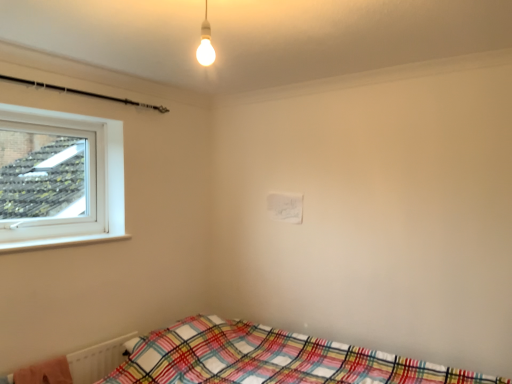
Find the location of a particular element. plaid fabric blanket at lower left is located at coordinates (45, 373).

In the image, there is a plaid fabric bed at lower right. Where is `blanket above it (from the image's perspective)`? Image resolution: width=512 pixels, height=384 pixels. blanket above it (from the image's perspective) is located at coordinates (45, 373).

Is plaid fabric blanket at lower left not within plaid fabric bed at lower right?

Yes.

Which is behind, plaid fabric blanket at lower left or plaid fabric bed at lower right?

plaid fabric blanket at lower left is behind.

Which point is more distant from viewer, (57, 359) or (193, 373)?

Positioned behind is point (193, 373).

Would you consider plaid fabric bed at lower right to be distant from plaid fabric blanket at lower left?

No, plaid fabric bed at lower right is not far away from plaid fabric blanket at lower left.

Can you confirm if plaid fabric bed at lower right is taller than plaid fabric blanket at lower left?

Yes.

Measure the distance between plaid fabric bed at lower right and plaid fabric blanket at lower left.

plaid fabric bed at lower right and plaid fabric blanket at lower left are 35.84 inches apart.

From a real-world perspective, which is physically below, plaid fabric bed at lower right or plaid fabric blanket at lower left?

In real-world perspective, plaid fabric bed at lower right is lower.

Does matte white bulb at upper center lie in front of plaid fabric blanket at lower left?

Yes, it is.

From their relative heights in the image, would you say matte white bulb at upper center is taller or shorter than plaid fabric blanket at lower left?

Considering their sizes, matte white bulb at upper center has more height than plaid fabric blanket at lower left.

Is matte white bulb at upper center to the right of plaid fabric blanket at lower left from the viewer's perspective?

Correct, you'll find matte white bulb at upper center to the right of plaid fabric blanket at lower left.

Could matte white bulb at upper center be considered to be inside plaid fabric bed at lower right?

No.

Considering the positions of points (323, 343) and (205, 47), is point (323, 343) closer to camera compared to point (205, 47)?

No, it is not.

Is plaid fabric bed at lower right in contact with matte white bulb at upper center?

No, plaid fabric bed at lower right is not beside matte white bulb at upper center.

Is matte white bulb at upper center with plaid fabric bed at lower right?

No.

Which is more to the right, matte white bulb at upper center or plaid fabric bed at lower right?

From the viewer's perspective, plaid fabric bed at lower right appears more on the right side.

Is plaid fabric bed at lower right at the back of matte white bulb at upper center?

matte white bulb at upper center does not have its back to plaid fabric bed at lower right.

Considering the relative sizes of matte white bulb at upper center and plaid fabric bed at lower right in the image provided, is matte white bulb at upper center bigger than plaid fabric bed at lower right?

Incorrect, matte white bulb at upper center is not larger than plaid fabric bed at lower right.

Can you confirm if plaid fabric blanket at lower left is smaller than matte white bulb at upper center?

Incorrect, plaid fabric blanket at lower left is not smaller in size than matte white bulb at upper center.

Measure the distance between plaid fabric blanket at lower left and matte white bulb at upper center.

A distance of 6.19 feet exists between plaid fabric blanket at lower left and matte white bulb at upper center.

Considering the positions of point (34, 381) and point (209, 34), is point (34, 381) closer or farther from the camera than point (209, 34)?

Clearly, point (34, 381) is more distant from the camera than point (209, 34).

From the image's perspective, relative to matte white bulb at upper center, is plaid fabric blanket at lower left above or below?

From the image's perspective, plaid fabric blanket at lower left appears below matte white bulb at upper center.

Find the location of `bed located underneath the plaid fabric blanket at lower left (from a real-world perspective)`. bed located underneath the plaid fabric blanket at lower left (from a real-world perspective) is located at coordinates (269, 359).

In the image, there is a plaid fabric bed at lower right. At what (x,y) coordinates should I click in order to perform the action: click on blanket above it (from the image's perspective). Please return your answer as a coordinate pair (x, y). This screenshot has height=384, width=512. Looking at the image, I should click on (45, 373).

Considering their positions, is plaid fabric bed at lower right positioned closer to plaid fabric blanket at lower left than matte white bulb at upper center?

plaid fabric bed at lower right is positioned closer to the anchor plaid fabric blanket at lower left.

Based on their spatial positions, is matte white bulb at upper center or plaid fabric bed at lower right closer to plaid fabric blanket at lower left?

The object closer to plaid fabric blanket at lower left is plaid fabric bed at lower right.

Considering their positions, is matte white bulb at upper center positioned closer to plaid fabric bed at lower right than plaid fabric blanket at lower left?

plaid fabric blanket at lower left is positioned closer to the anchor plaid fabric bed at lower right.

Looking at the image, which one is located closer to matte white bulb at upper center, plaid fabric blanket at lower left or plaid fabric bed at lower right?

plaid fabric bed at lower right is positioned closer to the anchor matte white bulb at upper center.

When comparing their distances from plaid fabric bed at lower right, does plaid fabric blanket at lower left or matte white bulb at upper center seem further?

The object further to plaid fabric bed at lower right is matte white bulb at upper center.

When comparing their distances from matte white bulb at upper center, does plaid fabric bed at lower right or plaid fabric blanket at lower left seem closer?

Based on the image, plaid fabric bed at lower right appears to be nearer to matte white bulb at upper center.

Identify the location of blanket between matte white bulb at upper center and plaid fabric bed at lower right from top to bottom. The width and height of the screenshot is (512, 384). (45, 373).